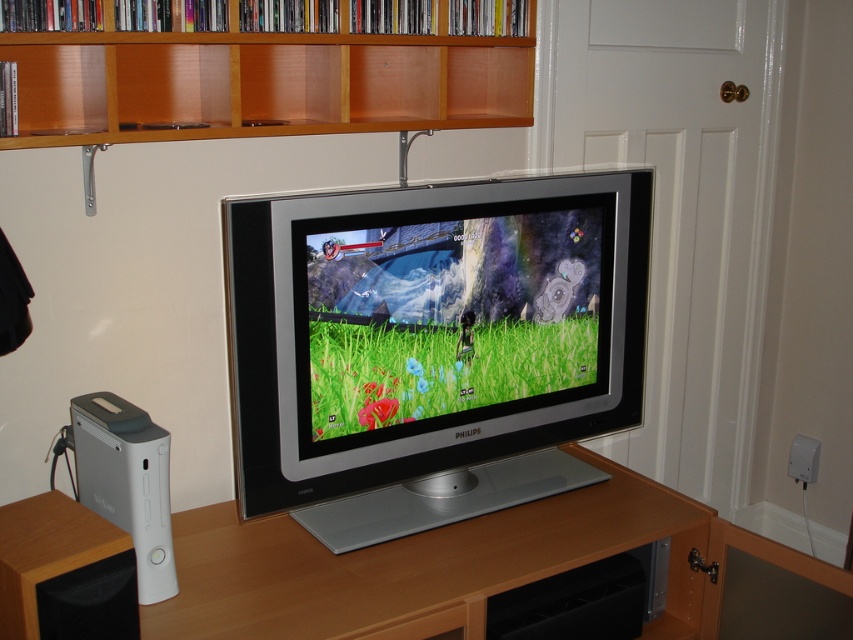
Which is in front, point (300, 220) or point (148, 109)?

Point (300, 220) is in front.

Which is more to the right, silver metallic television at center or wooden at upper center?

From the viewer's perspective, silver metallic television at center appears more on the right side.

Image resolution: width=853 pixels, height=640 pixels. In order to click on silver metallic television at center in this screenshot , I will do `click(431, 346)`.

Can you confirm if wooden at upper center is taller than brown wood speaker at lower left?

Yes, wooden at upper center is taller than brown wood speaker at lower left.

Is wooden at upper center positioned behind brown wood speaker at lower left?

Yes.

Does point (515, 72) come farther from viewer compared to point (20, 572)?

Yes, it is behind point (20, 572).

Find the location of `wooden at upper center`. wooden at upper center is located at coordinates (260, 83).

Based on the photo, between silver metallic television at center and wooden table at center, which one is positioned higher?

silver metallic television at center is above.

Is silver metallic television at center closer to camera compared to wooden table at center?

That is False.

Is point (335, 285) closer to camera compared to point (473, 584)?

No, (335, 285) is behind (473, 584).

The height and width of the screenshot is (640, 853). In order to click on silver metallic television at center in this screenshot , I will do `click(431, 346)`.